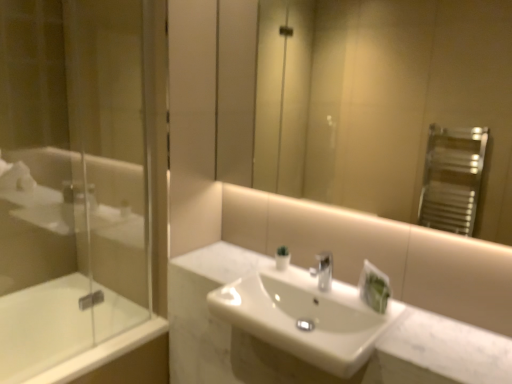
Question: Is transparent glass shower door at left bigger than white glossy bathtub at lower left?

Choices:
 (A) no
 (B) yes

Answer: (A)

Question: From the image's perspective, would you say transparent glass shower door at left is shown under white glossy bathtub at lower left?

Choices:
 (A) no
 (B) yes

Answer: (A)

Question: From the image's perspective, would you say transparent glass shower door at left is positioned over white glossy bathtub at lower left?

Choices:
 (A) no
 (B) yes

Answer: (B)

Question: From a real-world perspective, is transparent glass shower door at left below white glossy bathtub at lower left?

Choices:
 (A) yes
 (B) no

Answer: (B)

Question: Is transparent glass shower door at left next to white glossy bathtub at lower left and touching it?

Choices:
 (A) yes
 (B) no

Answer: (B)

Question: Is white glossy sink at center wider or thinner than white glossy bathtub at lower left?

Choices:
 (A) wide
 (B) thin

Answer: (B)

Question: Is point (318, 301) closer or farther from the camera than point (72, 329)?

Choices:
 (A) farther
 (B) closer

Answer: (B)

Question: In the image, is white glossy sink at center positioned in front of or behind white glossy bathtub at lower left?

Choices:
 (A) front
 (B) behind

Answer: (A)

Question: Is white glossy sink at center situated inside white glossy bathtub at lower left or outside?

Choices:
 (A) outside
 (B) inside

Answer: (A)

Question: In the image, is white glossy bathtub at lower left positioned in front of or behind white glossy sink at center?

Choices:
 (A) front
 (B) behind

Answer: (B)

Question: Is point (92, 360) positioned closer to the camera than point (330, 362)?

Choices:
 (A) farther
 (B) closer

Answer: (A)

Question: Is white glossy bathtub at lower left inside or outside of white glossy sink at center?

Choices:
 (A) inside
 (B) outside

Answer: (B)

Question: From a real-world perspective, is white glossy bathtub at lower left positioned above or below white glossy sink at center?

Choices:
 (A) above
 (B) below

Answer: (B)

Question: Is white glossy sink at center bigger or smaller than matte glass mirror at upper center?

Choices:
 (A) big
 (B) small

Answer: (A)

Question: From a real-world perspective, is white glossy sink at center positioned above or below matte glass mirror at upper center?

Choices:
 (A) above
 (B) below

Answer: (B)